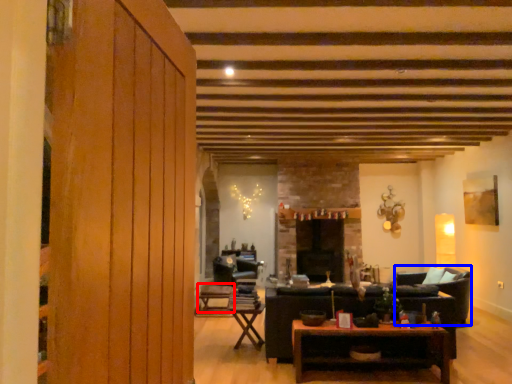
Question: Which object appears farthest to the camera in this image, table (highlighted by a red box) or armchair (highlighted by a blue box)?

Choices:
 (A) table
 (B) armchair

Answer: (A)